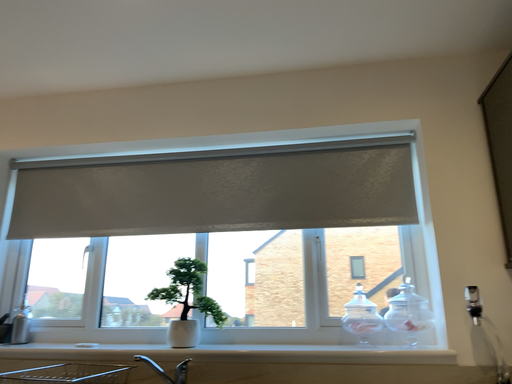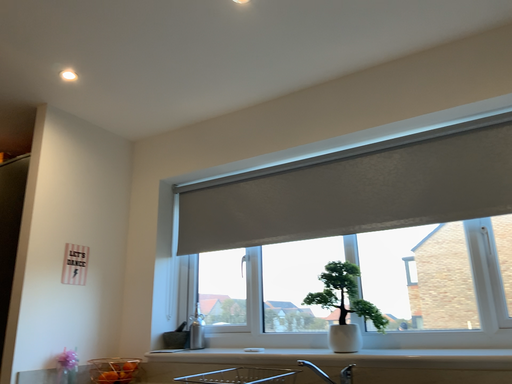
Question: Which way did the camera rotate in the video?

Choices:
 (A) rotated right
 (B) rotated left

Answer: (B)